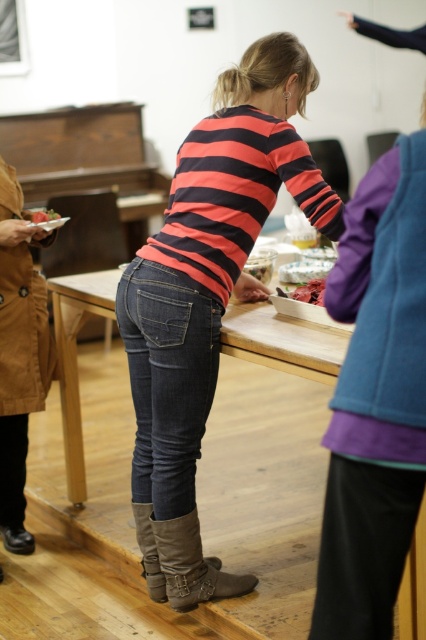
You are planning to place a pair of dark blue denim jeans at center on top of a smooth red plate at center. Will the jeans fit entirely on the plate?

The dark blue denim jeans at center are wider than the smooth red plate at center, so they won